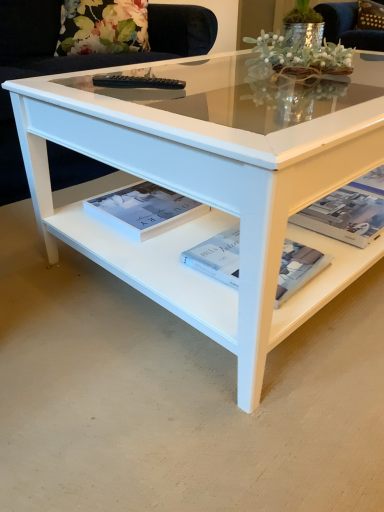
Question: From the image's perspective, would you say white glossy magazine at lower right, the 1th magazine from the right, is shown under white glossy book at center, the first magazine viewed from the left?

Choices:
 (A) yes
 (B) no

Answer: (A)

Question: Is white glossy magazine at lower right, which ranks as the 3th magazine in left-to-right order, at the left side of white glossy book at center, placed as the third magazine when sorted from right to left?

Choices:
 (A) no
 (B) yes

Answer: (A)

Question: Is white glossy magazine at lower right, which ranks as the 3th magazine in left-to-right order, thinner than white glossy book at center, the first magazine viewed from the left?

Choices:
 (A) yes
 (B) no

Answer: (B)

Question: Is white glossy magazine at lower right, which ranks as the 3th magazine in left-to-right order, next to white glossy book at center, placed as the third magazine when sorted from right to left, and touching it?

Choices:
 (A) yes
 (B) no

Answer: (B)

Question: Is white glossy magazine at lower right, which ranks as the 3th magazine in left-to-right order, facing away from white glossy book at center, the first magazine viewed from the left?

Choices:
 (A) yes
 (B) no

Answer: (B)

Question: Considering the relative positions of white glossy magazine at lower right, the 1th magazine from the right, and white glossy book at center, placed as the third magazine when sorted from right to left, in the image provided, is white glossy magazine at lower right, the 1th magazine from the right, to the right of white glossy book at center, placed as the third magazine when sorted from right to left, from the viewer's perspective?

Choices:
 (A) yes
 (B) no

Answer: (A)

Question: Does white glossy magazine at lower right, the 1th magazine from the right, appear on the left side of brown fabric pillow at upper right?

Choices:
 (A) no
 (B) yes

Answer: (B)

Question: Can you confirm if white glossy magazine at lower right, the 1th magazine from the right, is positioned to the right of brown fabric pillow at upper right?

Choices:
 (A) no
 (B) yes

Answer: (A)

Question: Is the position of white glossy magazine at lower right, which ranks as the 3th magazine in left-to-right order, less distant than that of brown fabric pillow at upper right?

Choices:
 (A) no
 (B) yes

Answer: (B)

Question: Does white glossy magazine at lower right, the 1th magazine from the right, have a smaller size compared to brown fabric pillow at upper right?

Choices:
 (A) yes
 (B) no

Answer: (A)

Question: From the image's perspective, does white glossy magazine at lower right, the 1th magazine from the right, appear lower than brown fabric pillow at upper right?

Choices:
 (A) yes
 (B) no

Answer: (A)

Question: Does white glossy magazine at lower right, the 1th magazine from the right, contain brown fabric pillow at upper right?

Choices:
 (A) no
 (B) yes

Answer: (A)

Question: From the image's perspective, does white glossy book at center, the first magazine viewed from the left, appear higher than white paper magazine at center, acting as the second magazine starting from the right?

Choices:
 (A) no
 (B) yes

Answer: (B)